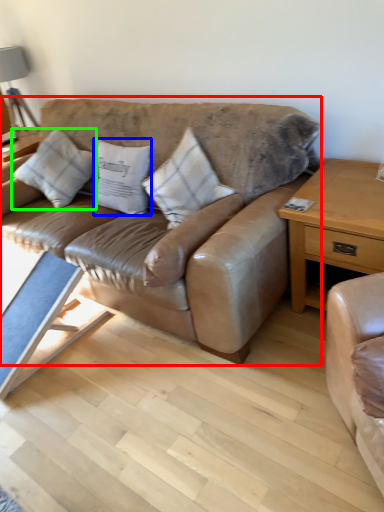
Question: Which object is the farthest from studio couch (highlighted by a red box)? Choose among these: pillow (highlighted by a blue box) or pillow (highlighted by a green box).

Choices:
 (A) pillow
 (B) pillow

Answer: (B)